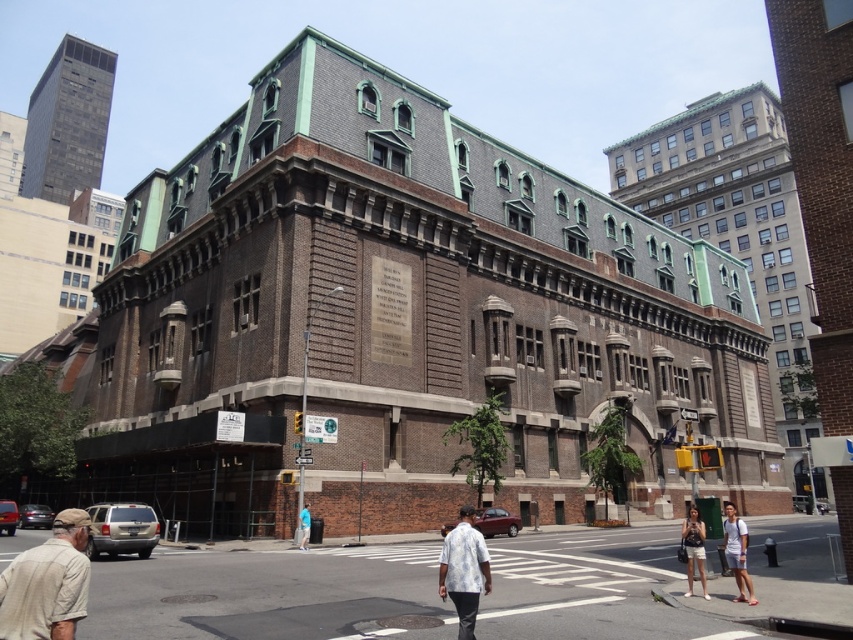
Question: Is denim shorts at lower right wider than blue cotton shirt at center?

Choices:
 (A) no
 (B) yes

Answer: (B)

Question: Where is light blue denim shorts at lower right located in relation to denim shorts at lower right in the image?

Choices:
 (A) above
 (B) below

Answer: (B)

Question: Can you confirm if denim shorts at lower right is positioned to the right of blue cotton shirt at center?

Choices:
 (A) no
 (B) yes

Answer: (B)

Question: Which object is closer to the camera taking this photo?

Choices:
 (A) light blue denim shorts at lower right
 (B) blue cotton shirt at center
 (C) white floral shirt at center
 (D) beige cotton shirt at lower left

Answer: (D)

Question: Which is nearer to the beige cotton shirt at lower left?

Choices:
 (A) white floral shirt at center
 (B) denim shorts at lower right
 (C) light blue denim shorts at lower right

Answer: (A)

Question: Based on their relative distances, which object is farther from the denim shorts at lower right?

Choices:
 (A) white floral shirt at center
 (B) beige cotton shirt at lower left

Answer: (B)